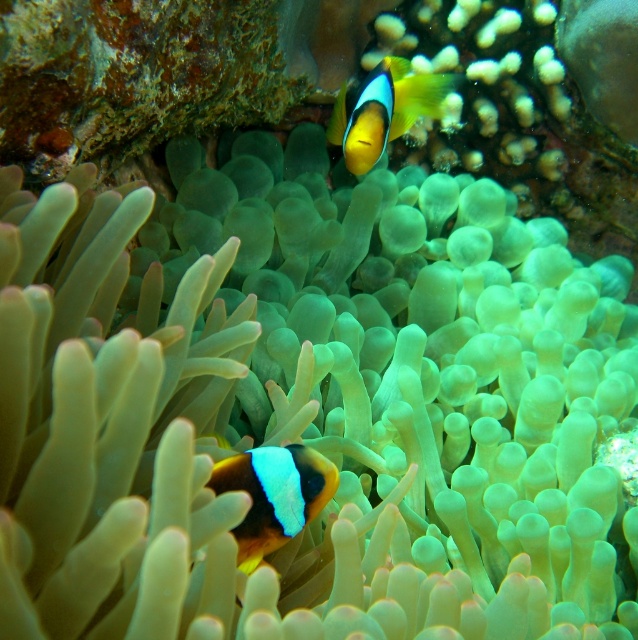
Looking at this image, is orange and white clownfish at center wider than yellow matte clownfish at upper center?

No, orange and white clownfish at center is not wider than yellow matte clownfish at upper center.

Who is higher up, orange and white clownfish at center or yellow matte clownfish at upper center?

Positioned higher is yellow matte clownfish at upper center.

At what (x,y) coordinates should I click in order to perform the action: click on orange and white clownfish at center. Please return your answer as a coordinate pair (x, y). This screenshot has height=640, width=638. Looking at the image, I should click on (274, 493).

The height and width of the screenshot is (640, 638). Identify the location of orange and white clownfish at center. (274, 493).